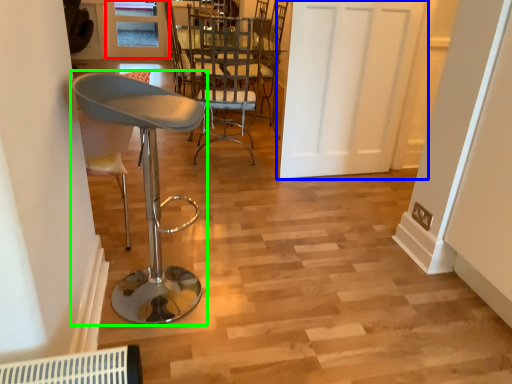
Question: Estimate the real-world distances between objects in this image. Which object is farther from window (highlighted by a red box), door (highlighted by a blue box) or chair (highlighted by a green box)?

Choices:
 (A) door
 (B) chair

Answer: (B)